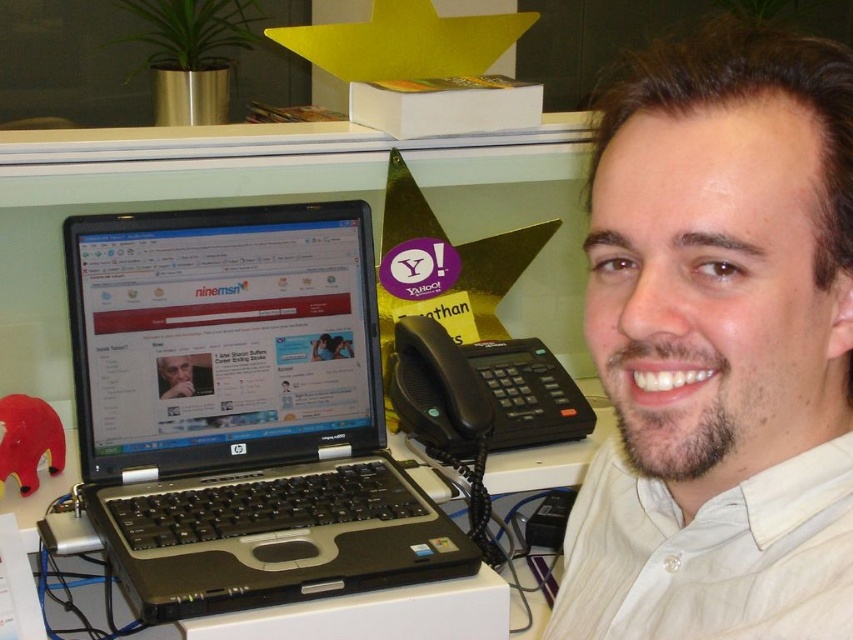
Question: Which object is positioned closest to the black plastic telephone at center?

Choices:
 (A) black plastic laptop at left
 (B) black plastic laptop at center
 (C) white shirt at center

Answer: (B)

Question: Considering the relative positions of black plastic laptop at left and black plastic telephone at center in the image provided, where is black plastic laptop at left located with respect to black plastic telephone at center?

Choices:
 (A) right
 (B) left

Answer: (B)

Question: Observing the image, what is the correct spatial positioning of black plastic laptop at left in reference to black plastic laptop at center?

Choices:
 (A) right
 (B) left

Answer: (B)

Question: Which point is farther to the camera?

Choices:
 (A) click(49, 496)
 (B) click(268, 515)

Answer: (A)

Question: Is black plastic laptop at left smaller than black plastic telephone at center?

Choices:
 (A) no
 (B) yes

Answer: (A)

Question: Which of the following is the farthest from the observer?

Choices:
 (A) white shirt at center
 (B) black plastic telephone at center

Answer: (B)